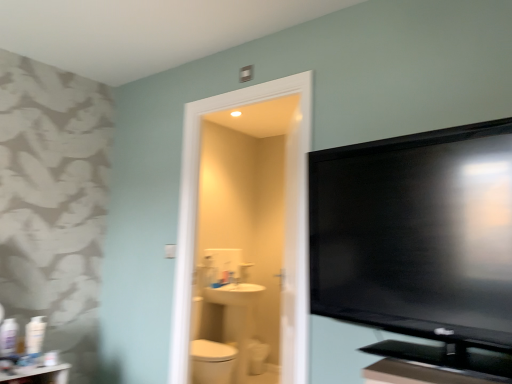
Question: From the image's perspective, would you say white plastic bottles at left, arranged as the second toiletry when viewed from the right, is positioned over white glossy toilet bowl at center?

Choices:
 (A) no
 (B) yes

Answer: (B)

Question: Is white plastic bottles at left, arranged as the second toiletry when viewed from the right, bigger than white glossy toilet bowl at center?

Choices:
 (A) no
 (B) yes

Answer: (A)

Question: Can you confirm if white plastic bottles at left, which appears as the 1th toiletry when viewed from the left, is smaller than white glossy toilet bowl at center?

Choices:
 (A) yes
 (B) no

Answer: (A)

Question: Could white glossy toilet bowl at center be considered to be inside white plastic bottles at left, which appears as the 1th toiletry when viewed from the left?

Choices:
 (A) no
 (B) yes

Answer: (A)

Question: Can you confirm if white plastic bottles at left, arranged as the second toiletry when viewed from the right, is taller than white glossy toilet bowl at center?

Choices:
 (A) no
 (B) yes

Answer: (B)

Question: Can you see white plastic bottles at left, which appears as the 1th toiletry when viewed from the left, touching white glossy toilet bowl at center?

Choices:
 (A) no
 (B) yes

Answer: (A)

Question: Is white plastic bottle at left, the 2th toiletry in the left-to-right sequence, shorter than white glossy toilet bowl at center?

Choices:
 (A) no
 (B) yes

Answer: (B)

Question: Does white plastic bottle at left, the 1th toiletry from the right, have a greater height compared to white glossy toilet bowl at center?

Choices:
 (A) yes
 (B) no

Answer: (B)

Question: From the image's perspective, is white plastic bottle at left, the 1th toiletry from the right, located above white glossy toilet bowl at center?

Choices:
 (A) yes
 (B) no

Answer: (A)

Question: Is white plastic bottle at left, the 2th toiletry in the left-to-right sequence, looking in the opposite direction of white glossy toilet bowl at center?

Choices:
 (A) no
 (B) yes

Answer: (A)

Question: Considering the relative positions of white plastic bottle at left, the 1th toiletry from the right, and white glossy toilet bowl at center in the image provided, is white plastic bottle at left, the 1th toiletry from the right, to the left of white glossy toilet bowl at center from the viewer's perspective?

Choices:
 (A) no
 (B) yes

Answer: (B)

Question: Is white plastic bottle at left, the 1th toiletry from the right, directly adjacent to white glossy toilet bowl at center?

Choices:
 (A) no
 (B) yes

Answer: (A)

Question: Is white glossy toilet bowl at center taller than white glossy table at lower left?

Choices:
 (A) no
 (B) yes

Answer: (B)